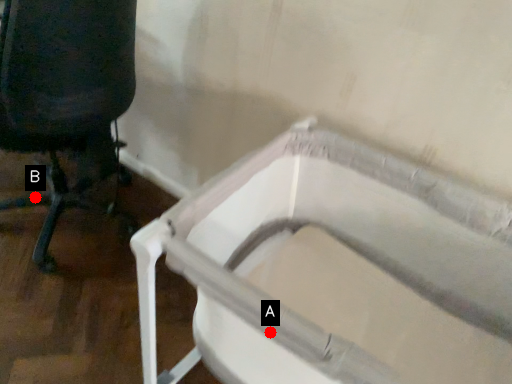
Question: Two points are circled on the image, labeled by A and B beside each circle. Among these points, which one is nearest to the camera?

Choices:
 (A) A is closer
 (B) B is closer

Answer: (A)